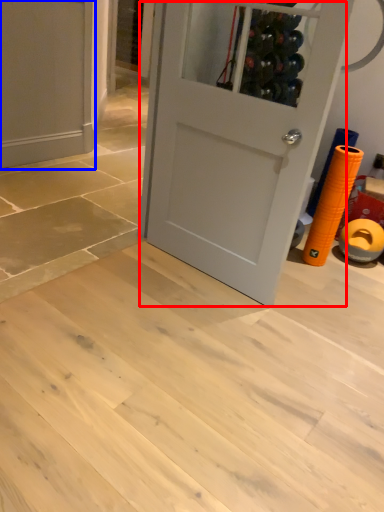
Question: Which point is further to the camera, door (highlighted by a red box) or door (highlighted by a blue box)?

Choices:
 (A) door
 (B) door

Answer: (B)